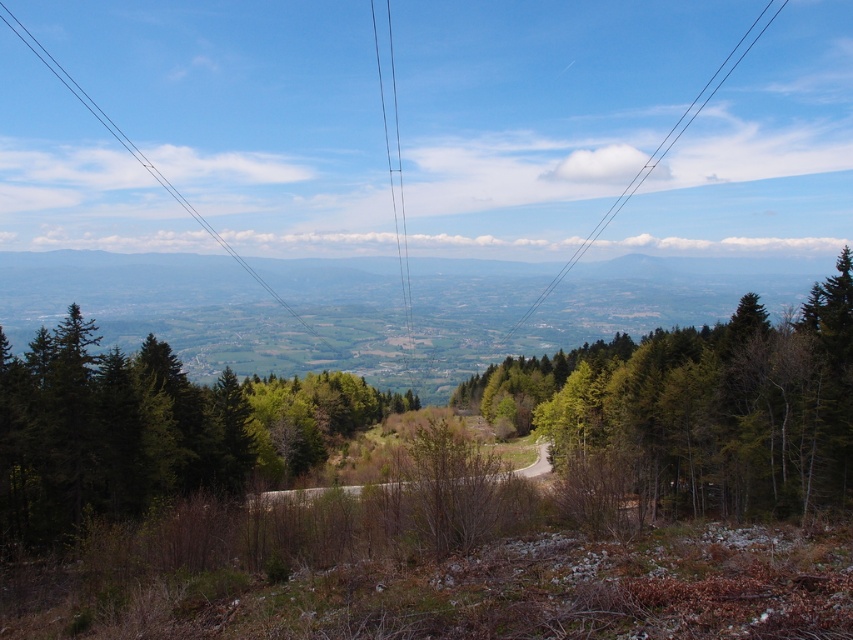
Question: Which point appears farthest from the camera in this image?

Choices:
 (A) (697, 108)
 (B) (318, 419)
 (C) (410, 332)
 (D) (4, 8)

Answer: (D)

Question: Which point is closer to the camera taking this photo?

Choices:
 (A) (386, 102)
 (B) (48, 60)
 (C) (13, 518)

Answer: (C)

Question: Is green leafy tree at center to the left of green evergreen trees at center from the viewer's perspective?

Choices:
 (A) yes
 (B) no

Answer: (B)

Question: Is green leafy tree at center bigger than green evergreen trees at center?

Choices:
 (A) yes
 (B) no

Answer: (A)

Question: Which object is farther from the camera taking this photo?

Choices:
 (A) black wire at center
 (B) green leafy tree at center
 (C) clear wire at upper center
 (D) black wire at upper center

Answer: (C)

Question: Does green leafy tree at center come in front of black wire at upper center?

Choices:
 (A) yes
 (B) no

Answer: (A)